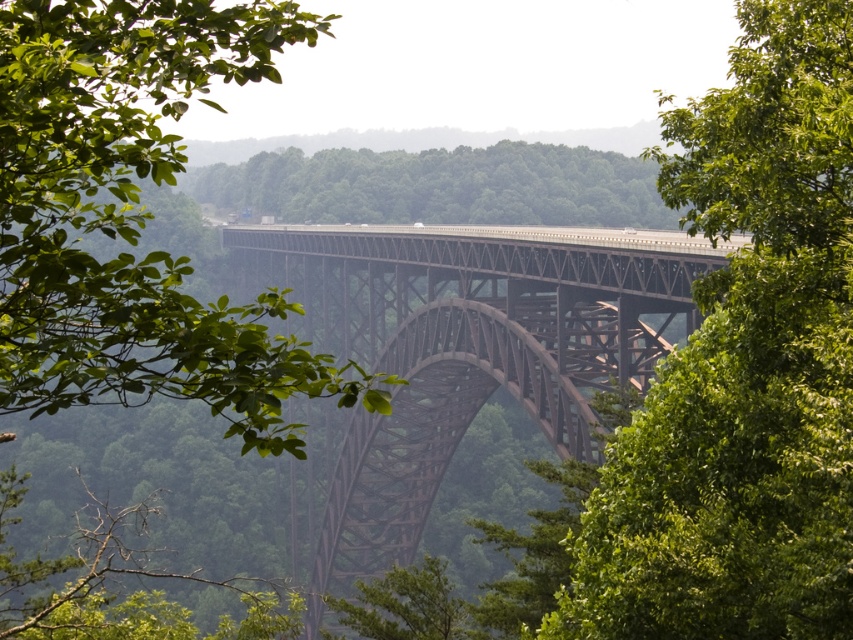
You are standing on the rusty metal bridge at center and want to reach the green leafy tree at center. Which direction should you walk to get there?

You should walk to the right because the green leafy tree at center is to the right of the rusty metal bridge at center.

You are a photographer planning to capture the entire rusty metal bridge at center and the green leafy tree at center in a single shot. Given that your camera has a fixed field of view, which object should you position closer to the center of the frame to ensure both are fully visible without cropping?

Since the green leafy tree at center has a lesser width compared to the rusty metal bridge at center, positioning the green leafy tree at center closer to the center of the frame would allow the wider rusty metal bridge at center to fit within the camera field of view while keeping both objects in the shot.

You are a photographer planning to capture the green leafy tree at center and the rusty metal bridge at center in a single frame. Based on their positions, can you determine which object will appear larger in your photo?

The green leafy tree at center is above the rusty metal bridge at center, so the tree will appear larger in the photo because it is closer to the camera compared to the bridge below it.